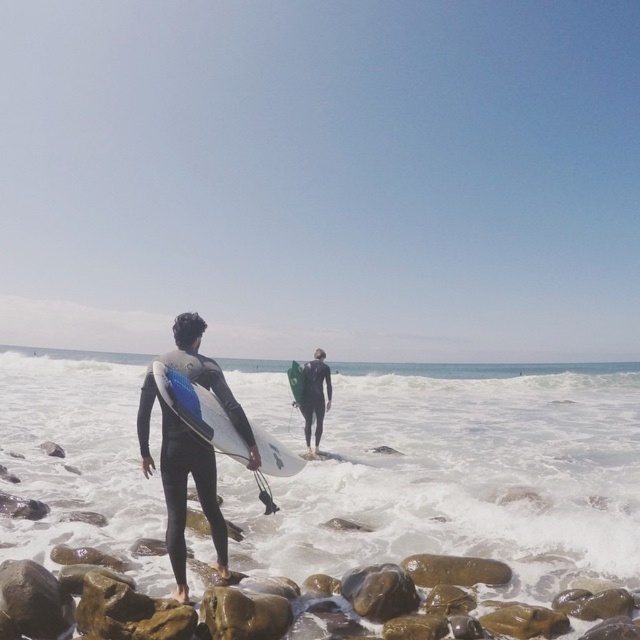
Question: Does blue glossy surfboard at center have a greater width compared to black wetsuit at center?

Choices:
 (A) yes
 (B) no

Answer: (A)

Question: Does black wetsuit at center have a larger size compared to green matte surfboard at center?

Choices:
 (A) no
 (B) yes

Answer: (B)

Question: Which object appears closest to the camera in this image?

Choices:
 (A) white foam water at lower center
 (B) black matte wetsuit at center
 (C) blue glossy surfboard at center

Answer: (C)

Question: Which point is farther to the camera?

Choices:
 (A) black matte wetsuit at center
 (B) green matte surfboard at center
 (C) blue glossy surfboard at center

Answer: (B)

Question: Is black matte wetsuit at center thinner than blue glossy surfboard at center?

Choices:
 (A) yes
 (B) no

Answer: (A)

Question: Among these objects, which one is nearest to the camera?

Choices:
 (A) black matte wetsuit at center
 (B) green matte surfboard at center
 (C) blue glossy surfboard at center
 (D) black wetsuit at center

Answer: (C)